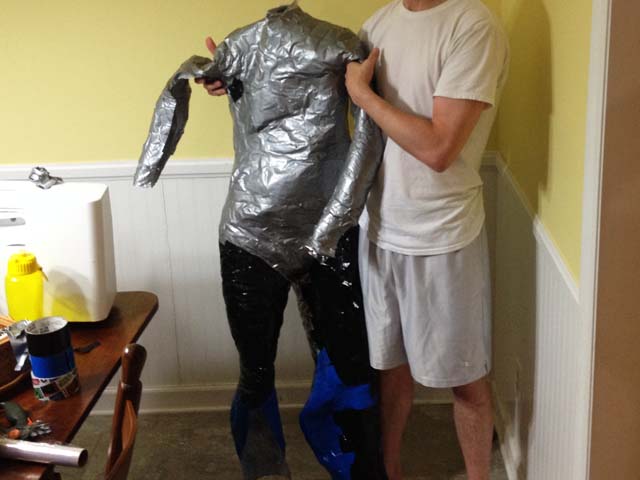
The height and width of the screenshot is (480, 640). What are the coordinates of `back of wood chair` in the screenshot? It's located at (129, 431).